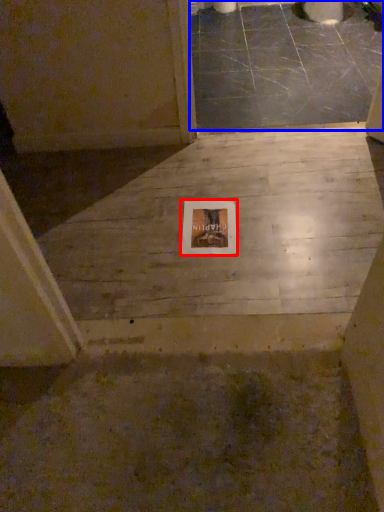
Question: Which point is closer to the camera, picture frame (highlighted by a red box) or concrete (highlighted by a blue box)?

Choices:
 (A) picture frame
 (B) concrete

Answer: (A)